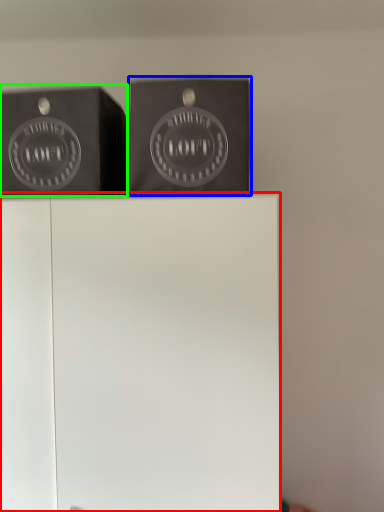
Question: Considering the real-world distances, which object is closest to furniture (highlighted by a red box)? package (highlighted by a blue box) or writing (highlighted by a green box).

Choices:
 (A) package
 (B) writing

Answer: (A)